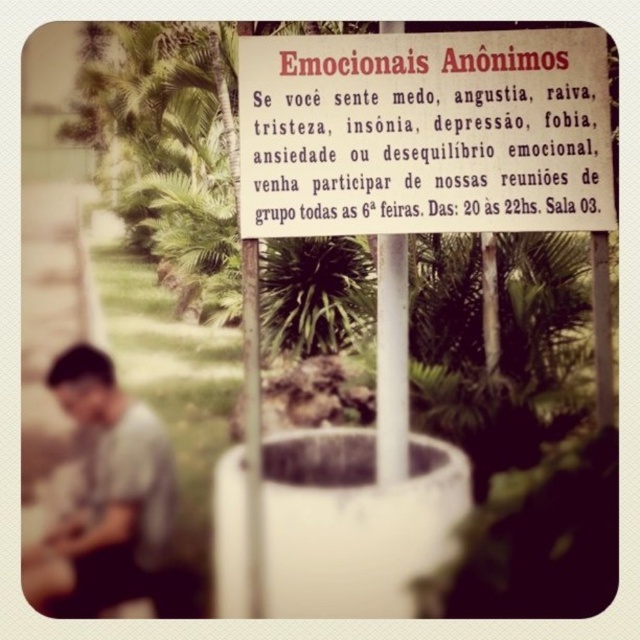
Question: Among these objects, which one is nearest to the camera?

Choices:
 (A) white paper sign at center
 (B) gray matte shirt at lower left

Answer: (B)

Question: Does white paper sign at center have a greater width compared to gray matte shirt at lower left?

Choices:
 (A) yes
 (B) no

Answer: (A)

Question: Which point is farther to the camera?

Choices:
 (A) (74, 417)
 (B) (355, 184)

Answer: (B)

Question: From the image, what is the correct spatial relationship of white paper sign at center in relation to gray matte shirt at lower left?

Choices:
 (A) right
 (B) left

Answer: (A)

Question: Can you confirm if white paper sign at center is positioned to the right of gray matte shirt at lower left?

Choices:
 (A) yes
 (B) no

Answer: (A)